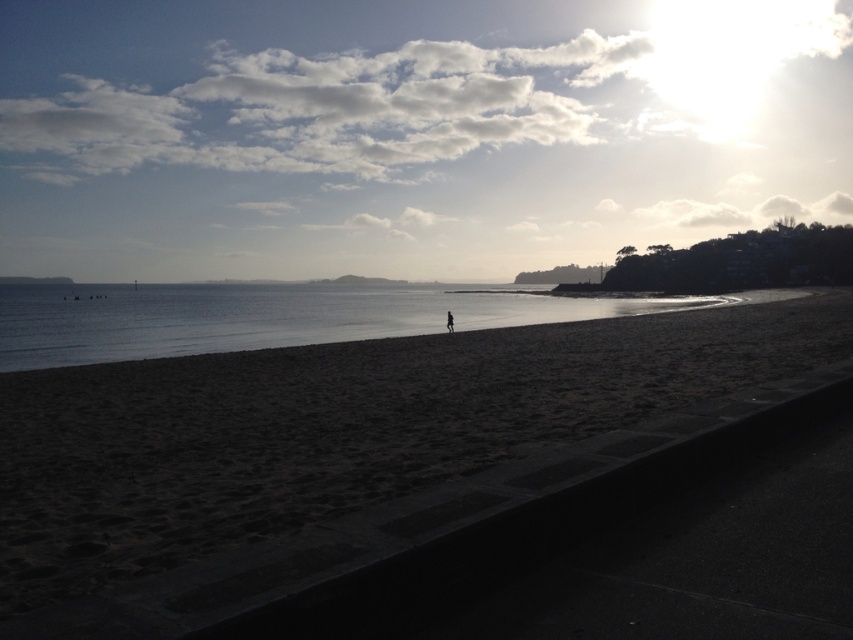
Between point (390, 458) and point (448, 310), which one is positioned in front?

Point (390, 458) is more forward.

How far apart are dark sand at center and black fabric person at center?

24.72 meters

Who is more forward, (x=341, y=403) or (x=447, y=324)?

Point (x=341, y=403) is in front.

Locate an element on the screen. This screenshot has height=640, width=853. dark sand at center is located at coordinates (334, 428).

Does clear water at center appear under black fabric person at center?

No.

The image size is (853, 640). I want to click on clear water at center, so click(268, 317).

Does point (132, 323) come farther from viewer compared to point (450, 323)?

Yes, point (132, 323) is farther from viewer.

Identify the location of clear water at center. The image size is (853, 640). (268, 317).

Consider the image. Can you confirm if dark sand at center is positioned to the right of clear water at center?

Indeed, dark sand at center is positioned on the right side of clear water at center.

Who is lower down, dark sand at center or clear water at center?

dark sand at center

Locate an element on the screen. The image size is (853, 640). dark sand at center is located at coordinates (334, 428).